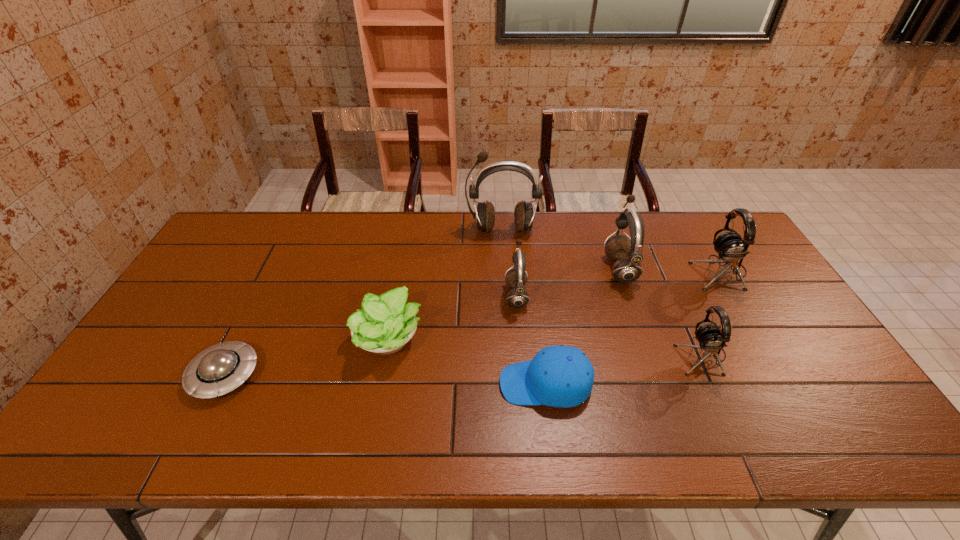
You are a GUI agent. You are given a task and a screenshot of the screen. Output one action in this format:
    pyautogui.click(x=<x>, y=<y>)
    Task: Click on the vacant area in the image that satisfies the following two spatial constraints: 1. on the ear pads of the third object from right to left; 2. on the back side of the bigger black earphone
    
    Given the screenshot: What is the action you would take?
    pyautogui.click(x=620, y=272)

What are the coordinates of `vacant area in the image that satisfies the following two spatial constraints: 1. on the ear pads of the tallest earphone; 2. on the left side of the right black earphone` in the screenshot? It's located at (505, 272).

Where is `free location that satisfies the following two spatial constraints: 1. on the ear pads of the rightmost brown earphone; 2. on the front side of the lettuce`? free location that satisfies the following two spatial constraints: 1. on the ear pads of the rightmost brown earphone; 2. on the front side of the lettuce is located at coordinates (643, 338).

Identify the location of vacant space that satisfies the following two spatial constraints: 1. on the ear pads of the nearest earphone; 2. on the right side of the smallest brown earphone. This screenshot has width=960, height=540. tap(521, 355).